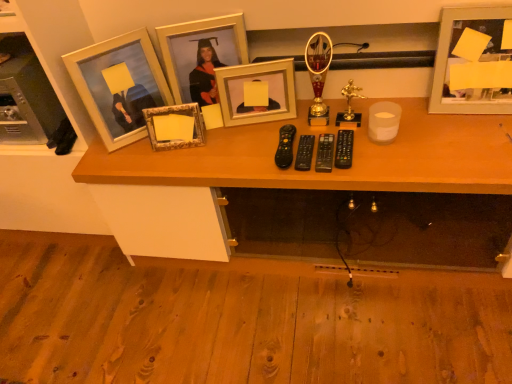
Question: Can you confirm if gold metallic picture frame at upper center, arranged as the 3th picture frame when viewed from the left, is wider than gold metallic picture frame at center, which is counted as the 4th picture frame, starting from the left?

Choices:
 (A) no
 (B) yes

Answer: (B)

Question: Can you confirm if gold metallic picture frame at upper center, placed as the third picture frame when sorted from right to left, is taller than gold metallic picture frame at center, marked as the second picture frame in a right-to-left arrangement?

Choices:
 (A) no
 (B) yes

Answer: (B)

Question: From a real-world perspective, does gold metallic picture frame at upper center, placed as the third picture frame when sorted from right to left, sit lower than gold metallic picture frame at center, which is counted as the 4th picture frame, starting from the left?

Choices:
 (A) yes
 (B) no

Answer: (B)

Question: Is gold metallic picture frame at upper center, placed as the third picture frame when sorted from right to left, thinner than gold metallic picture frame at center, which is counted as the 4th picture frame, starting from the left?

Choices:
 (A) yes
 (B) no

Answer: (B)

Question: From a real-world perspective, is gold metallic picture frame at upper center, placed as the third picture frame when sorted from right to left, on top of gold metallic picture frame at center, marked as the second picture frame in a right-to-left arrangement?

Choices:
 (A) no
 (B) yes

Answer: (B)

Question: Considering their positions, is gold metallic picture frame at center, marked as the second picture frame in a right-to-left arrangement, located in front of or behind metallic silver picture frame at upper right, the fifth picture frame in the left-to-right sequence?

Choices:
 (A) behind
 (B) front

Answer: (A)

Question: Is gold metallic picture frame at center, marked as the second picture frame in a right-to-left arrangement, bigger or smaller than metallic silver picture frame at upper right, the fifth picture frame in the left-to-right sequence?

Choices:
 (A) small
 (B) big

Answer: (A)

Question: Based on their positions, is gold metallic picture frame at center, which is counted as the 4th picture frame, starting from the left, located to the left or right of metallic silver picture frame at upper right, the first picture frame from the right?

Choices:
 (A) left
 (B) right

Answer: (A)

Question: Is point (232, 120) closer or farther from the camera than point (462, 26)?

Choices:
 (A) closer
 (B) farther

Answer: (B)

Question: Would you say wooden desk at center is inside or outside matte wooden picture frame at left, the fifth picture frame when ordered from right to left?

Choices:
 (A) outside
 (B) inside

Answer: (A)

Question: From a real-world perspective, is wooden desk at center above or below matte wooden picture frame at left, the 1th picture frame viewed from the left?

Choices:
 (A) below
 (B) above

Answer: (A)

Question: Based on their sizes in the image, would you say wooden desk at center is bigger or smaller than matte wooden picture frame at left, the 1th picture frame viewed from the left?

Choices:
 (A) small
 (B) big

Answer: (B)

Question: In terms of width, does wooden desk at center look wider or thinner when compared to matte wooden picture frame at left, the 1th picture frame viewed from the left?

Choices:
 (A) thin
 (B) wide

Answer: (B)

Question: Considering the positions of gold metallic picture frame at center, marked as the second picture frame in a right-to-left arrangement, and wooden desk at center in the image, is gold metallic picture frame at center, marked as the second picture frame in a right-to-left arrangement, taller or shorter than wooden desk at center?

Choices:
 (A) tall
 (B) short

Answer: (B)

Question: From the image's perspective, relative to wooden desk at center, is gold metallic picture frame at center, which is counted as the 4th picture frame, starting from the left, above or below?

Choices:
 (A) below
 (B) above

Answer: (B)